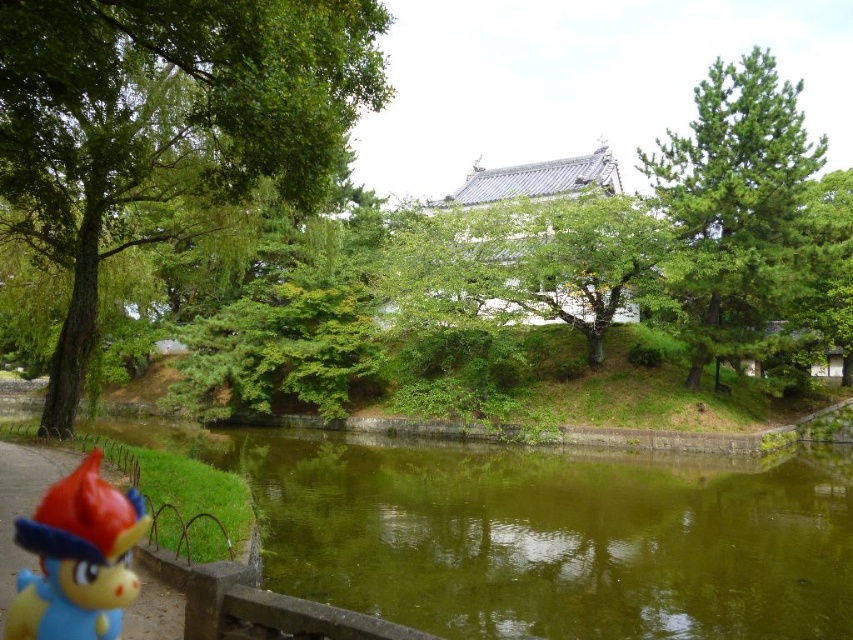
Question: Can you confirm if green water at center is smaller than green leafy tree at left?

Choices:
 (A) no
 (B) yes

Answer: (A)

Question: Which of the following is the farthest from the observer?

Choices:
 (A) (706, 321)
 (B) (309, 476)

Answer: (A)

Question: Which object appears farthest from the camera in this image?

Choices:
 (A) green needle-like at upper right
 (B) rubberized blue toy at lower left
 (C) green water at center
 (D) green leafy tree at left

Answer: (A)

Question: Is green water at center to the right of green leafy tree at left from the viewer's perspective?

Choices:
 (A) no
 (B) yes

Answer: (B)

Question: Which object appears farthest from the camera in this image?

Choices:
 (A) green needle-like at upper right
 (B) green water at center

Answer: (A)

Question: Does green leafy tree at left appear over green needle-like at upper right?

Choices:
 (A) yes
 (B) no

Answer: (B)